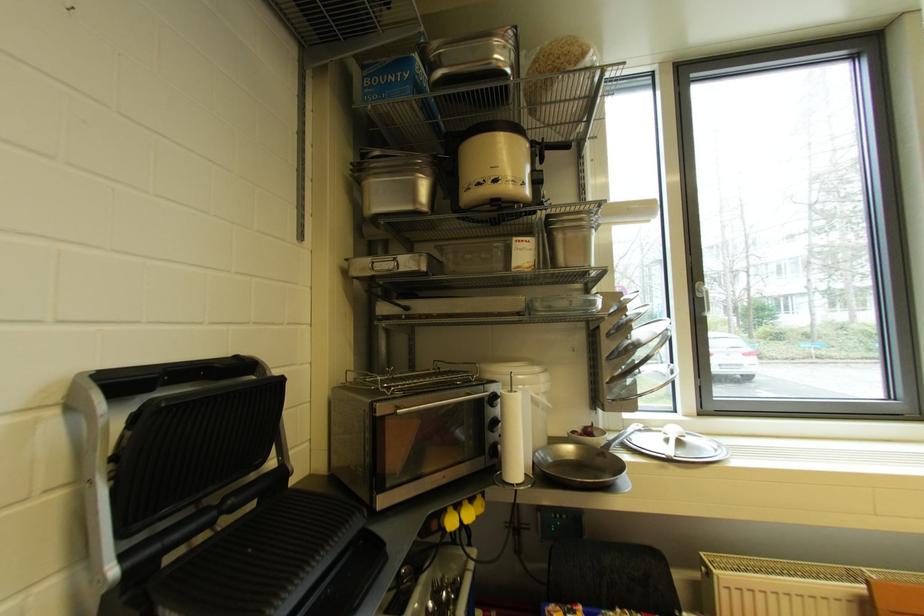
Where would you pull the paper towel roll? Please return your answer as a coordinate pair (x, y).

(515, 436)